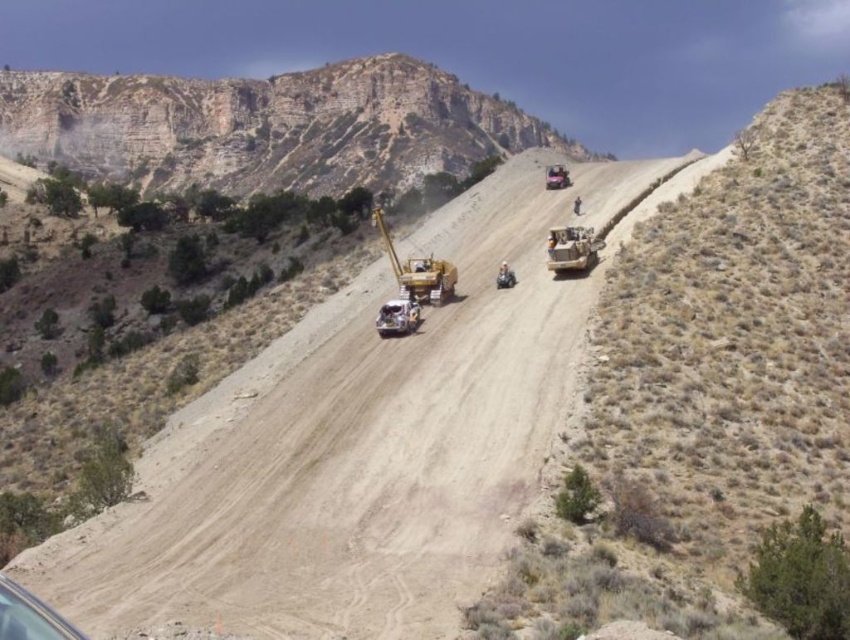
Can you confirm if transparent plastic car at lower left is taller than yellow rubber tracked vehicle at center?

No.

Does transparent plastic car at lower left appear on the left side of yellow rubber tracked vehicle at center?

Yes, transparent plastic car at lower left is to the left of yellow rubber tracked vehicle at center.

What do you see at coordinates (29, 616) in the screenshot? This screenshot has height=640, width=850. I see `transparent plastic car at lower left` at bounding box center [29, 616].

Where is `transparent plastic car at lower left`? transparent plastic car at lower left is located at coordinates (29, 616).

Does dirt road at center come behind metallic yellow truck at center?

No, it is not.

Identify the location of dirt road at center. (355, 449).

Is transparent plastic car at lower left above metallic yellow bulldozer at center?

No.

Consider the image. Can you confirm if transparent plastic car at lower left is bigger than metallic yellow bulldozer at center?

No, transparent plastic car at lower left is not bigger than metallic yellow bulldozer at center.

Does point (71, 632) come in front of point (565, 230)?

Yes.

Locate an element on the screen. transparent plastic car at lower left is located at coordinates (29, 616).